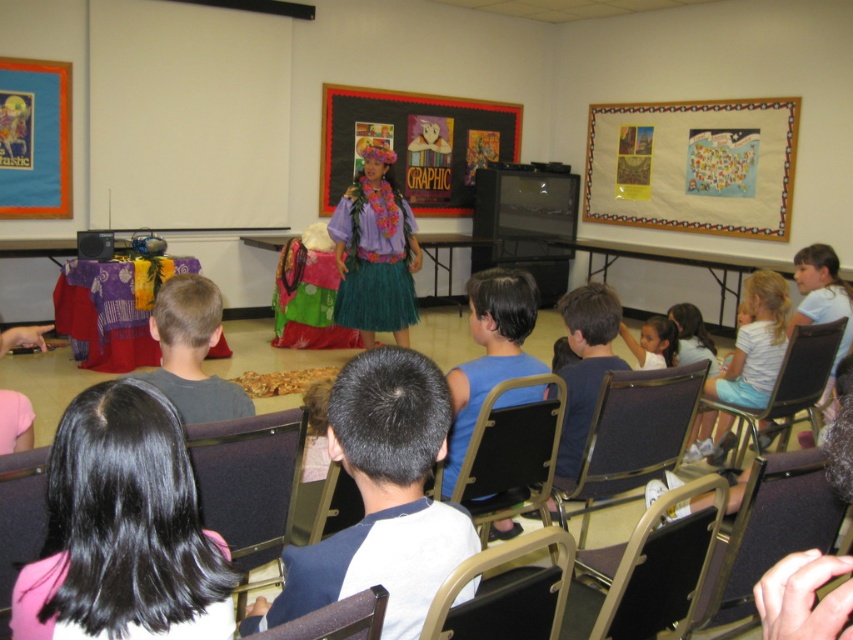
You are a photographer in the classroom and want to take a clear photo of the black hair at center without the metallic gray chair at lower right appearing in the background. Is this possible based on their positions?

The black hair at center is in front of the metallic gray chair at lower right, so taking a clear photo of the black hair at center without the metallic gray chair at lower right in the background would require adjusting the angle or moving the chair, as the chair is currently behind the hair and would likely be visible in the shot.

You are a teacher preparing to seat two students in the classroom. You have a black fabric chair at lower center and a metallic gold chair at center available. If you want to choose the wider chair for a student who needs more space, which chair should you select?

The metallic gold chair at center is wider than the black fabric chair at lower center, so you should select the metallic gold chair at center for the student who needs more space.